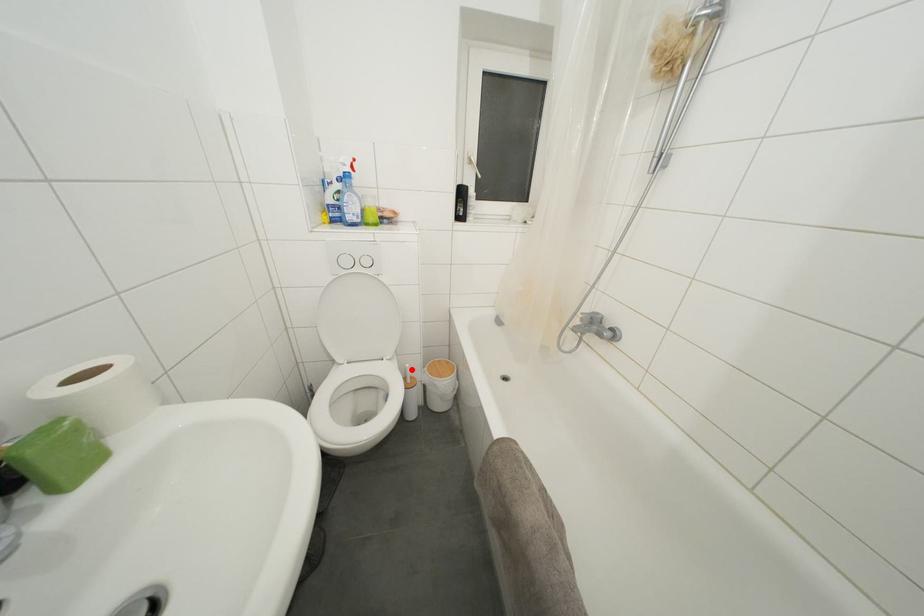
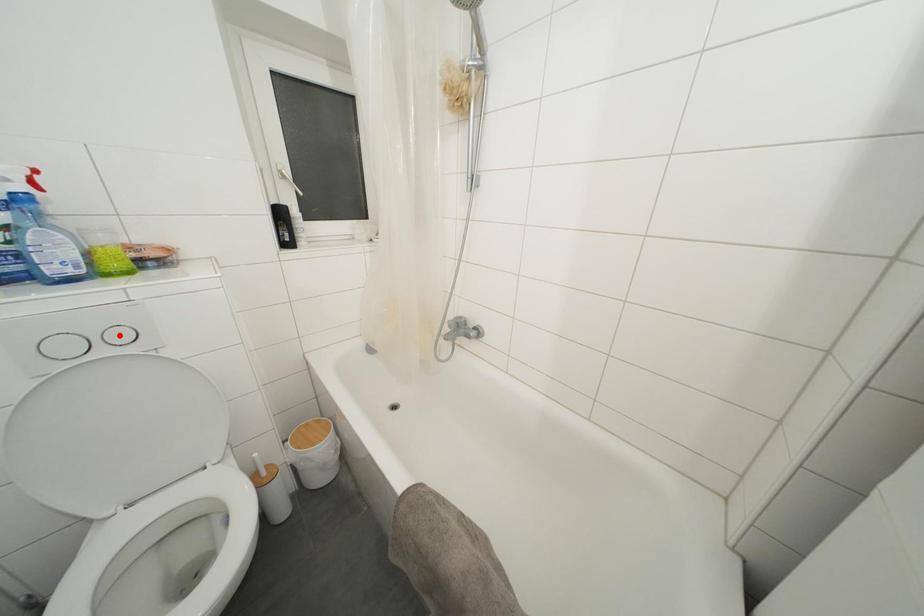
I am providing you with two images of the same scene from different viewpoints. A red point is marked on the first image and another point is marked on the second image. Is the marked point in image1 the same physical position as the marked point in image2?

No